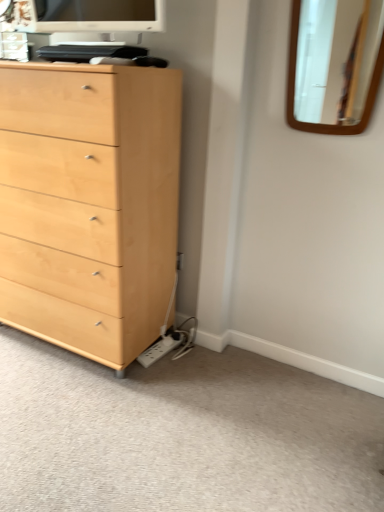
Question: Is matte white monitor at upper center aimed at light wood chest of drawers at left?

Choices:
 (A) no
 (B) yes

Answer: (A)

Question: Is matte white monitor at upper center thinner than light wood chest of drawers at left?

Choices:
 (A) no
 (B) yes

Answer: (B)

Question: Can you confirm if matte white monitor at upper center is positioned to the left of light wood chest of drawers at left?

Choices:
 (A) no
 (B) yes

Answer: (A)

Question: From a real-world perspective, is matte white monitor at upper center positioned under light wood chest of drawers at left based on gravity?

Choices:
 (A) yes
 (B) no

Answer: (B)

Question: Does matte white monitor at upper center have a larger size compared to light wood chest of drawers at left?

Choices:
 (A) yes
 (B) no

Answer: (B)

Question: From a real-world perspective, relative to wooden mirror at upper right, is light wood chest of drawers at left vertically above or below?

Choices:
 (A) above
 (B) below

Answer: (B)

Question: Considering the positions of light wood chest of drawers at left and wooden mirror at upper right in the image, is light wood chest of drawers at left wider or thinner than wooden mirror at upper right?

Choices:
 (A) wide
 (B) thin

Answer: (A)

Question: In terms of size, does light wood chest of drawers at left appear bigger or smaller than wooden mirror at upper right?

Choices:
 (A) big
 (B) small

Answer: (A)

Question: Is light wood chest of drawers at left spatially inside wooden mirror at upper right, or outside of it?

Choices:
 (A) outside
 (B) inside

Answer: (A)

Question: Do you think matte white monitor at upper center is within wooden mirror at upper right, or outside of it?

Choices:
 (A) outside
 (B) inside

Answer: (A)

Question: From a real-world perspective, is matte white monitor at upper center above or below wooden mirror at upper right?

Choices:
 (A) above
 (B) below

Answer: (A)

Question: In the image, is matte white monitor at upper center on the left side or the right side of wooden mirror at upper right?

Choices:
 (A) left
 (B) right

Answer: (A)

Question: From the image's perspective, is matte white monitor at upper center above or below wooden mirror at upper right?

Choices:
 (A) below
 (B) above

Answer: (B)

Question: From the image's perspective, is light wood chest of drawers at left above or below matte white monitor at upper center?

Choices:
 (A) below
 (B) above

Answer: (A)

Question: Is light wood chest of drawers at left inside the boundaries of matte white monitor at upper center, or outside?

Choices:
 (A) outside
 (B) inside

Answer: (A)